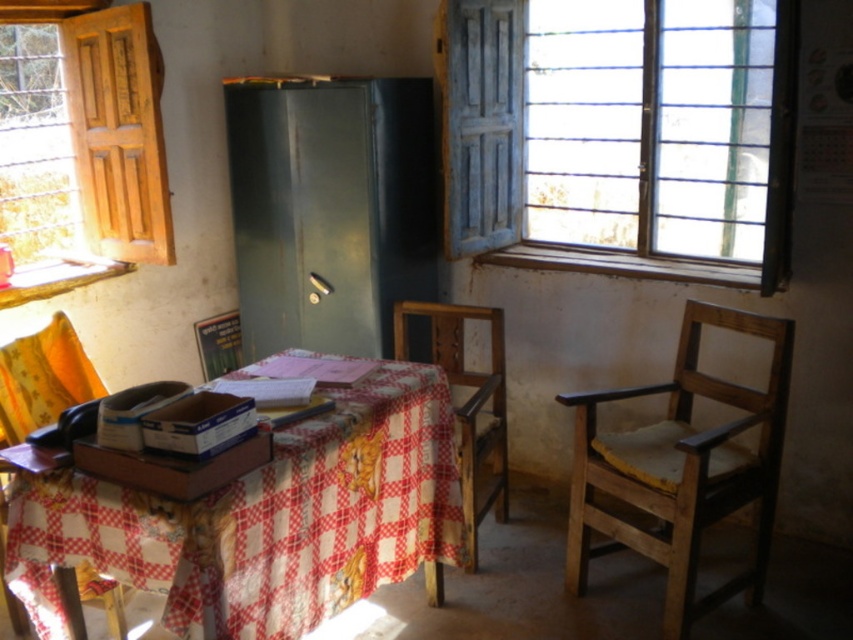
Question: Is checkered fabric table at center to the right of wooden frame at upper left from the viewer's perspective?

Choices:
 (A) yes
 (B) no

Answer: (A)

Question: Which object is positioned farthest from the metallic gray fridge at center?

Choices:
 (A) yellow fabric chair at left
 (B) wooden frame at upper left
 (C) wooden chair at right

Answer: (C)

Question: Can you confirm if wooden frame at upper left is positioned above wooden chair at right?

Choices:
 (A) no
 (B) yes

Answer: (B)

Question: Which object appears closest to the camera in this image?

Choices:
 (A) wooden frame at upper left
 (B) wooden chair at right

Answer: (B)

Question: Is blue painted wood at upper right wider than checkered fabric table at center?

Choices:
 (A) yes
 (B) no

Answer: (A)

Question: Among these points, which one is nearest to the camera?

Choices:
 (A) tap(537, 164)
 (B) tap(224, 100)
 (C) tap(483, 515)

Answer: (C)